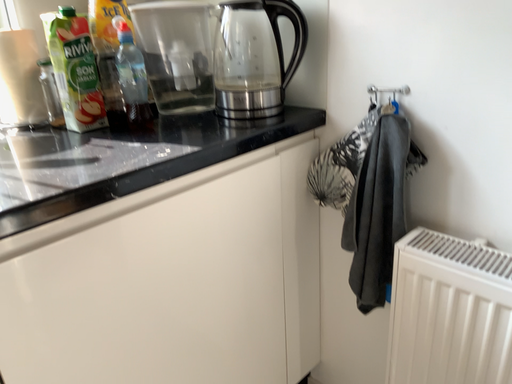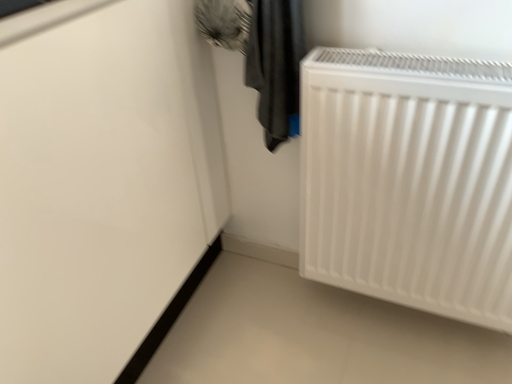
Question: Which way did the camera rotate in the video?

Choices:
 (A) rotated left
 (B) rotated right

Answer: (B)